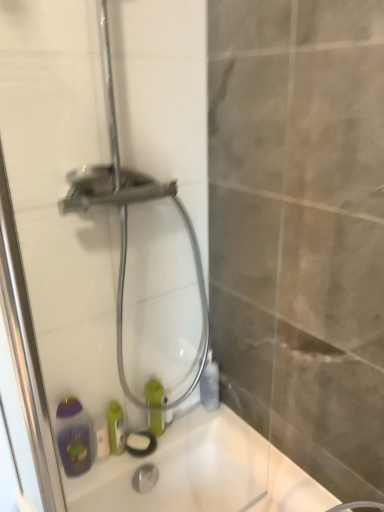
Question: Considering the positions of transparent glass shower door at center and green matte bottle at center, which is the second bottle in right-to-left order, in the image, is transparent glass shower door at center bigger or smaller than green matte bottle at center, which is the second bottle in right-to-left order,?

Choices:
 (A) big
 (B) small

Answer: (A)

Question: Is transparent glass shower door at center inside the boundaries of green matte bottle at center, which is the second bottle in right-to-left order, or outside?

Choices:
 (A) outside
 (B) inside

Answer: (A)

Question: Which is farther from the white glossy bath at lower left?

Choices:
 (A) white matte soap bar at lower left
 (B) green matte bottle at center, which is the second bottle in right-to-left order
 (C) transparent glass shower door at center
 (D) matte gray bottle at right, the second bottle when ordered from left to right

Answer: (C)

Question: Based on their relative distances, which object is nearer to the transparent glass shower door at center?

Choices:
 (A) matte gray bottle at right, the first bottle viewed from the right
 (B) white glossy bath at lower left
 (C) white matte soap bar at lower left
 (D) green matte bottle at center, placed as the 1th bottle when sorted from left to right

Answer: (B)